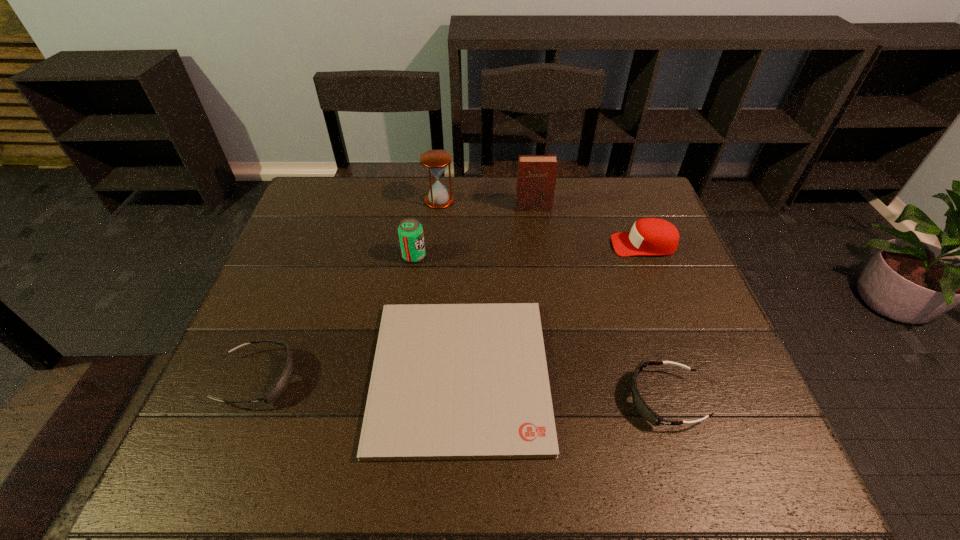
Find the location of a particular element. This screenshot has height=540, width=960. vacant area in the image that satisfies the following two spatial constraints: 1. on the front cover of the diary; 2. on the lenses of the left goggles is located at coordinates (557, 379).